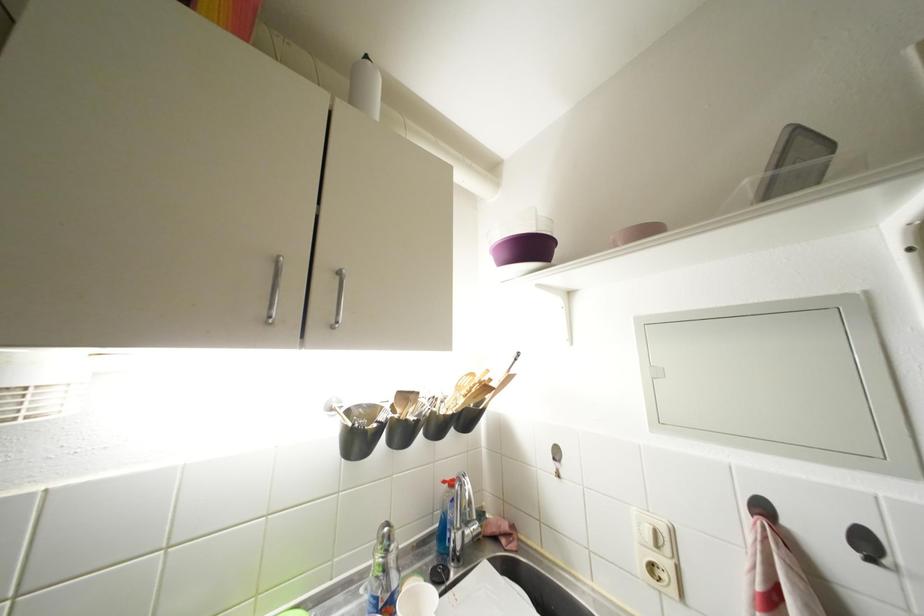
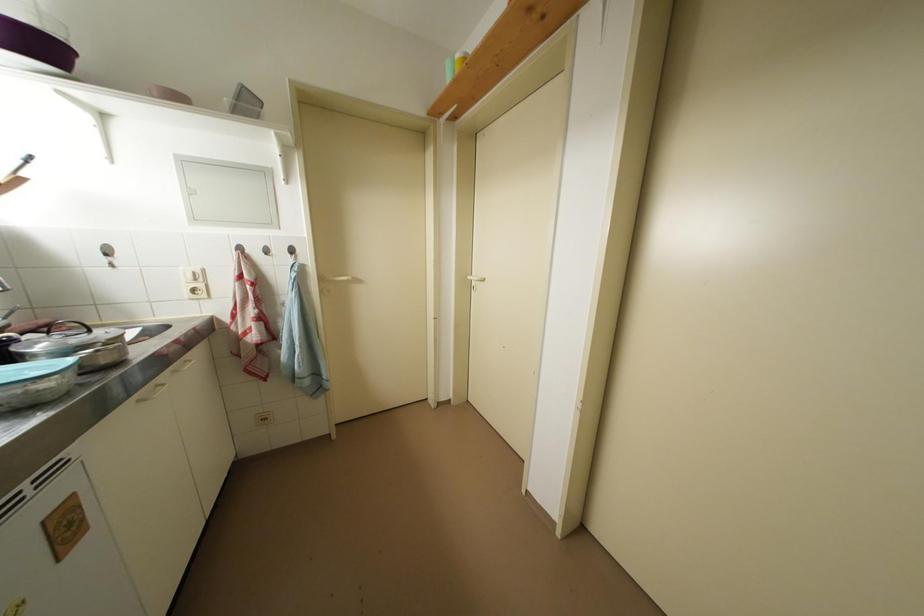
Locate, in the second image, the point that corresponds to (x=662, y=537) in the first image.

(201, 277)